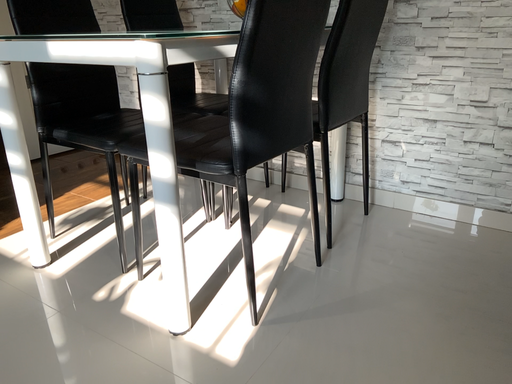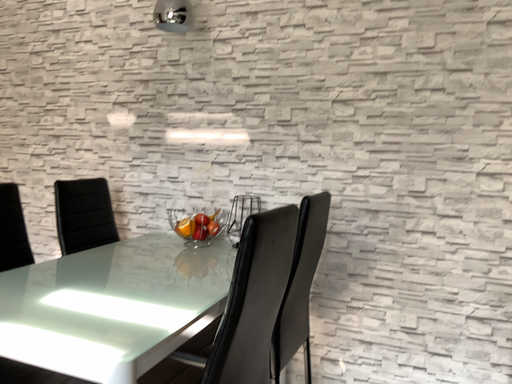
Question: Which way did the camera rotate in the video?

Choices:
 (A) rotated downward
 (B) rotated upward

Answer: (B)